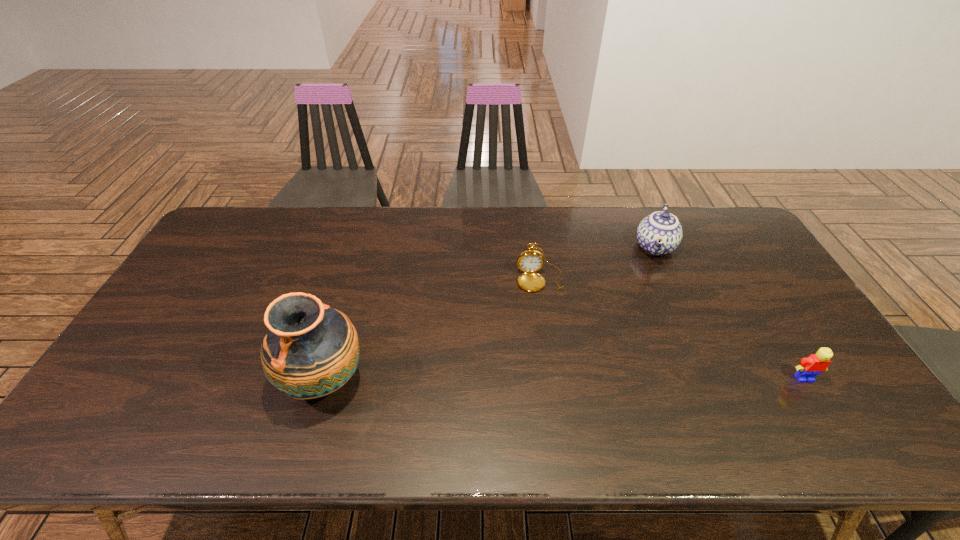
The image size is (960, 540). I want to click on blank area located 0.340m from the spout of the second object from right to left, so click(x=635, y=344).

Identify the location of vacant region located from the spout of the second object from right to left. The width and height of the screenshot is (960, 540). (641, 318).

This screenshot has width=960, height=540. I want to click on vacant region located from the spout of the second object from right to left, so click(x=648, y=293).

What are the coordinates of `object that is positioned at the far edge` in the screenshot? It's located at (660, 233).

Find the location of a particular element. pottery that is at the near edge is located at coordinates (310, 350).

Locate an element on the screen. Lego that is at the near edge is located at coordinates (809, 368).

Where is `object at the right edge`? The image size is (960, 540). object at the right edge is located at coordinates (809, 368).

You are a GUI agent. You are given a task and a screenshot of the screen. Output one action in this format:
    pyautogui.click(x=<x>, y=<y>)
    Task: Click on the object located in the near right corner section of the desktop
    The height and width of the screenshot is (540, 960).
    Given the screenshot: What is the action you would take?
    pyautogui.click(x=809, y=368)

In order to click on free region at the far edge of the desktop in this screenshot , I will do `click(404, 218)`.

The height and width of the screenshot is (540, 960). Find the location of `free space at the near edge`. free space at the near edge is located at coordinates (557, 392).